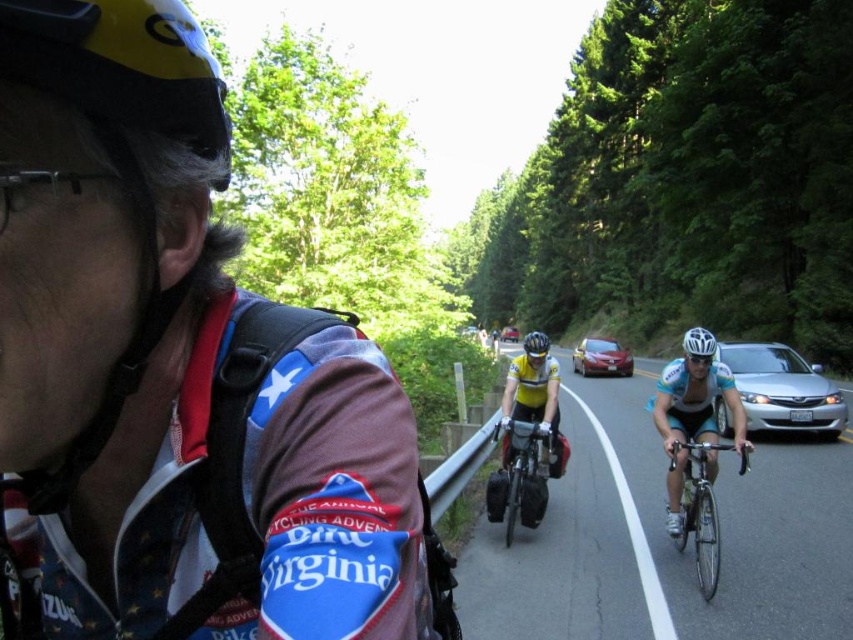
You are a photographer standing at the roadside watching the cyclists pass by. You notice two helmets in your viewfinder, the yellow matte helmet at upper left and the white matte helmet at center. Which helmet is positioned higher in your field of view?

The yellow matte helmet at upper left is positioned higher in the field of view than the white matte helmet at center.

You are a photographer standing at the starting line of a cycling event. You want to take a photo that includes both the white matte bicycle helmet at center and the cyclist wearing a yellow helmet and glasses in the foreground. Since you have a camera with a 50mm lens, which has a standard field of view, can you fit both subjects into the frame without moving closer or farther away?

The white matte bicycle helmet at center is 19.63 feet away from the camera. Since the cyclist wearing a yellow helmet and glasses is in the foreground, they are closer to the camera than the white matte bicycle helmet. A 50mm lens on a full frame camera has a field of view similar to human vision, so if both subjects are along the same line of sight and the distance between them isn photography, you should be able to include both in the frame without needing to adjust your position.

You are a cyclist in the group and want to check the distance between your position and the point at coordinates (184, 48). Can you determine if this point is within arm reach?

The point at coordinates (184, 48) is 80.85 centimeters away from the camera, so it is within arm reach.